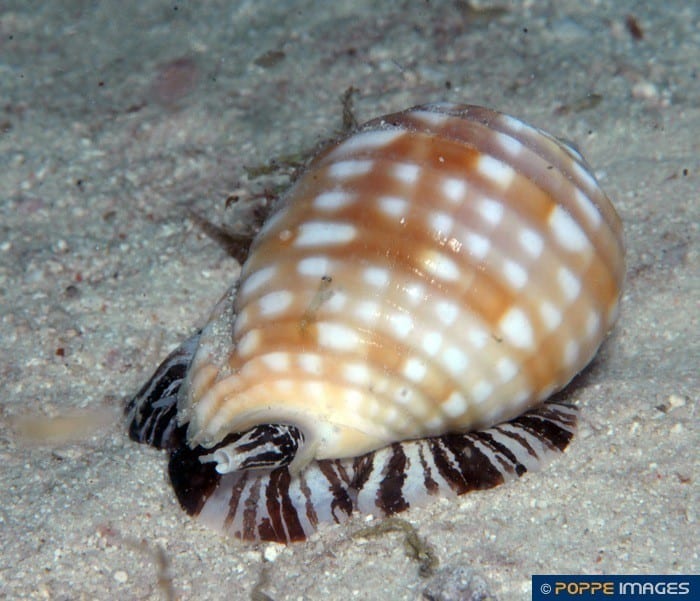
This screenshot has width=700, height=601. Identify the location of light reflections. (453, 245), (414, 276), (400, 300), (376, 334).